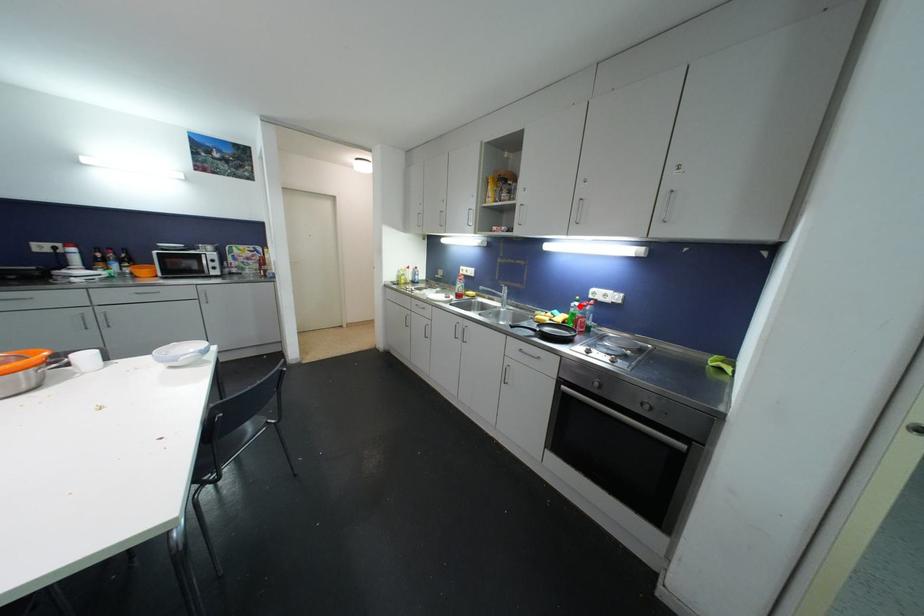
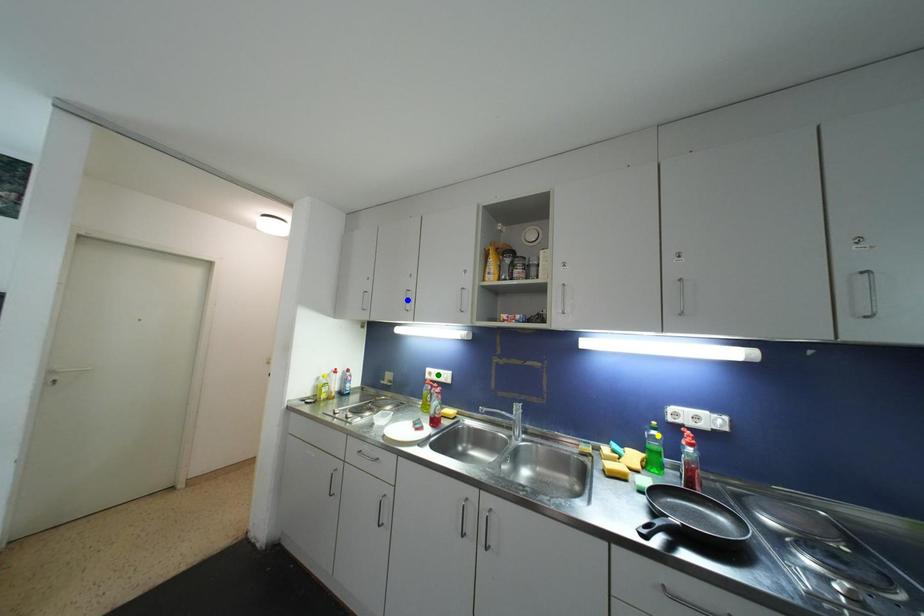
Question: I am providing you with two images of the same scene from different viewpoints. A red point is marked on the first image. You are given multiple points on the second image. Which point in image 2 is actually the same real-world point as the red point in image 1?

Choices:
 (A) blue point
 (B) yellow point
 (C) green point

Answer: (B)